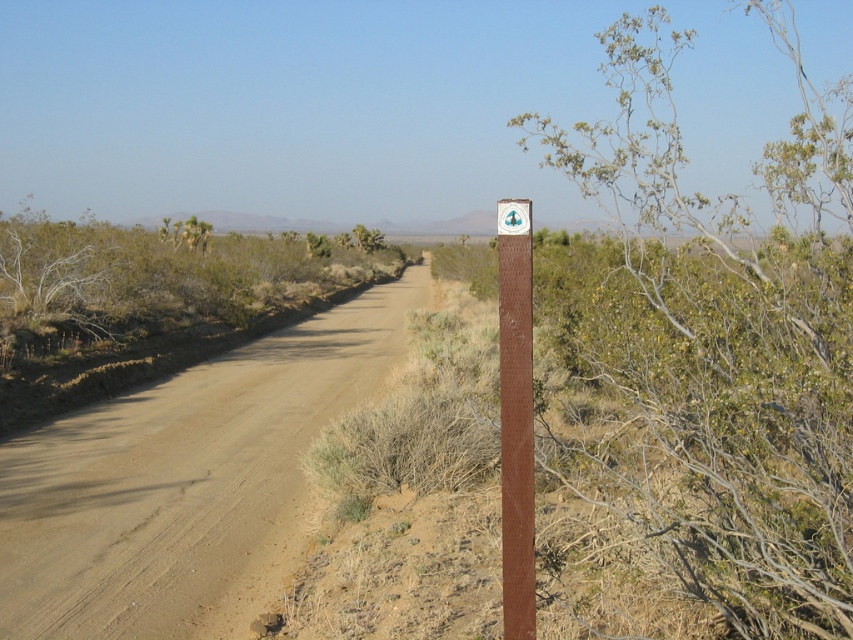
Question: Does brown sandy dirt track at center appear on the right side of white plastic sign at center?

Choices:
 (A) no
 (B) yes

Answer: (A)

Question: Can you confirm if brown sandy dirt track at center is positioned to the left of white plastic sign at center?

Choices:
 (A) no
 (B) yes

Answer: (B)

Question: Which of the following is the farthest from the observer?

Choices:
 (A) (288, 499)
 (B) (521, 224)
 (C) (525, 520)

Answer: (A)

Question: Which point is farther to the camera?

Choices:
 (A) (508, 477)
 (B) (497, 209)

Answer: (B)

Question: Can you confirm if brown wooden post at center is positioned to the right of white plastic sign at center?

Choices:
 (A) yes
 (B) no

Answer: (B)

Question: Which is nearer to the white plastic sign at center?

Choices:
 (A) brown sandy dirt track at center
 (B) brown wooden post at center

Answer: (B)